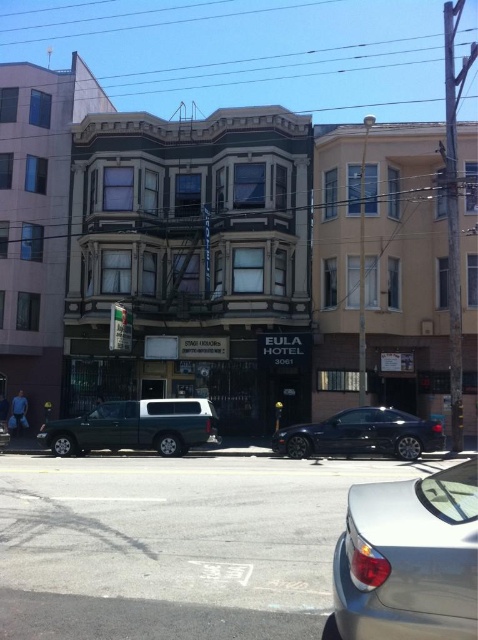
Question: Is green matte truck at center positioned at the back of shiny dark blue car at center?

Choices:
 (A) no
 (B) yes

Answer: (B)

Question: Which of the following is the farthest from the observer?

Choices:
 (A) green matte truck at center
 (B) satin silver sedan at lower right

Answer: (A)

Question: From the image, what is the correct spatial relationship of gray asphalt road at lower center in relation to shiny dark blue car at center?

Choices:
 (A) left
 (B) right

Answer: (A)

Question: Which point is farther to the camera?

Choices:
 (A) (389, 548)
 (B) (296, 456)
 (C) (49, 637)
 (D) (187, 404)

Answer: (D)

Question: Which point is farther to the camera?

Choices:
 (A) (430, 611)
 (B) (397, 410)
 (C) (91, 497)

Answer: (B)

Question: Does gray asphalt road at lower center appear over green matte truck at center?

Choices:
 (A) no
 (B) yes

Answer: (B)